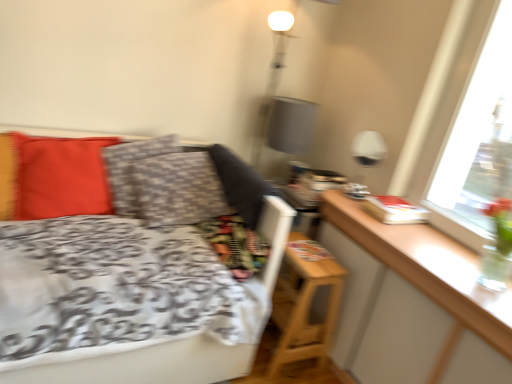
What do you see at coordinates (58, 176) in the screenshot? I see `matte red pillow at left, which is counted as the 2th pillow, starting from the right` at bounding box center [58, 176].

Find the location of a particular element. This screenshot has width=512, height=384. wooden nightstand at lower right is located at coordinates (304, 302).

Find the location of `matte red pillow at left, which is counted as the 2th pillow, starting from the right`. matte red pillow at left, which is counted as the 2th pillow, starting from the right is located at coordinates (58, 176).

Looking at their sizes, would you say wooden table at right is wider or thinner than wooden nightstand at lower right?

In the image, wooden table at right appears to be more narrow than wooden nightstand at lower right.

Between wooden table at right and wooden nightstand at lower right, which one is positioned in front?

wooden table at right is closer to the camera.

Is wooden table at right surrounding wooden nightstand at lower right?

Result: No, wooden nightstand at lower right is not inside wooden table at right.

Between wooden table at right and wooden nightstand at lower right, which one appears on the left side from the viewer's perspective?

wooden nightstand at lower right.

In the scene shown: Can you confirm if matte red pillow at left, the first pillow viewed from the left, is taller than patterned fabric pillow at center, which appears as the 1th pillow when viewed from the right?

Correct, matte red pillow at left, the first pillow viewed from the left, is much taller as patterned fabric pillow at center, which appears as the 1th pillow when viewed from the right.

Which object is wider, matte red pillow at left, the first pillow viewed from the left, or patterned fabric pillow at center, acting as the 2th pillow starting from the left?

patterned fabric pillow at center, acting as the 2th pillow starting from the left, is wider.

Is matte red pillow at left, the first pillow viewed from the left, not inside patterned fabric pillow at center, which appears as the 1th pillow when viewed from the right?

That's correct, matte red pillow at left, the first pillow viewed from the left, is outside of patterned fabric pillow at center, which appears as the 1th pillow when viewed from the right.

The image size is (512, 384). In the image, there is a patterned fabric pillow at center, which appears as the 1th pillow when viewed from the right. In order to click on pillow below it (from a real-world perspective) in this screenshot , I will do `click(58, 176)`.

In terms of width, does wooden nightstand at lower right look wider or thinner when compared to matte red pillow at left, the first pillow viewed from the left?

Considering their sizes, wooden nightstand at lower right looks broader than matte red pillow at left, the first pillow viewed from the left.

Does wooden nightstand at lower right have a larger size compared to matte red pillow at left, the first pillow viewed from the left?

Correct, wooden nightstand at lower right is larger in size than matte red pillow at left, the first pillow viewed from the left.

Considering the relative positions of wooden nightstand at lower right and matte red pillow at left, which is counted as the 2th pillow, starting from the right, in the image provided, is wooden nightstand at lower right to the left of matte red pillow at left, which is counted as the 2th pillow, starting from the right, from the viewer's perspective?

In fact, wooden nightstand at lower right is to the right of matte red pillow at left, which is counted as the 2th pillow, starting from the right.

Where is `nightstand behind the matte red pillow at left, the first pillow viewed from the left`? nightstand behind the matte red pillow at left, the first pillow viewed from the left is located at coordinates (304, 302).

Would you say patterned fabric pillow at center, acting as the 2th pillow starting from the left, contains white glossy table lamp at upper right?

No, patterned fabric pillow at center, acting as the 2th pillow starting from the left, does not contain white glossy table lamp at upper right.

Is there a large distance between patterned fabric pillow at center, which appears as the 1th pillow when viewed from the right, and white glossy table lamp at upper right?

Absolutely, patterned fabric pillow at center, which appears as the 1th pillow when viewed from the right, is distant from white glossy table lamp at upper right.

From the image's perspective, between patterned fabric pillow at center, acting as the 2th pillow starting from the left, and white glossy table lamp at upper right, which one is located above?

From the image's view, white glossy table lamp at upper right is above.

The image size is (512, 384). In order to click on pillow that is the 1st one when counting forward from the white glossy table lamp at upper right in this screenshot , I will do `click(128, 169)`.

In the image, is wooden nightstand at lower right on the left side or the right side of wooden table at right?

wooden nightstand at lower right is positioned on wooden table at right's left side.

Does wooden nightstand at lower right have a larger size compared to wooden table at right?

Correct, wooden nightstand at lower right is larger in size than wooden table at right.

In the scene shown: Is wooden table at right located within wooden nightstand at lower right?

Definitely not — wooden table at right is not inside wooden nightstand at lower right.

Considering the relative sizes of wooden nightstand at lower right and wooden table at right in the image provided, is wooden nightstand at lower right shorter than wooden table at right?

No.

Are wooden table at right and matte red pillow at left, the first pillow viewed from the left, far apart?

Yes, wooden table at right is far from matte red pillow at left, the first pillow viewed from the left.

Between point (343, 198) and point (65, 178), which one is positioned behind?

The point (343, 198) is farther.

Considering the relative sizes of wooden table at right and matte red pillow at left, which is counted as the 2th pillow, starting from the right, in the image provided, is wooden table at right thinner than matte red pillow at left, which is counted as the 2th pillow, starting from the right,?

No, wooden table at right is not thinner than matte red pillow at left, which is counted as the 2th pillow, starting from the right.

How many degrees apart are the facing directions of wooden nightstand at lower right and white glossy table lamp at upper right?

0.000437 degrees separate the facing orientations of wooden nightstand at lower right and white glossy table lamp at upper right.

Identify the location of nightstand in front of the white glossy table lamp at upper right. The image size is (512, 384). (304, 302).

Does wooden nightstand at lower right have a larger size compared to white glossy table lamp at upper right?

Yes.

Image resolution: width=512 pixels, height=384 pixels. Identify the location of table located on the right of wooden nightstand at lower right. (412, 303).

At what (x,y) coordinates should I click in order to perform the action: click on pillow located behind the matte red pillow at left, the first pillow viewed from the left. Please return your answer as a coordinate pair (x, y). This screenshot has width=512, height=384. Looking at the image, I should click on (128, 169).

Looking at the image, which one is located closer to wooden table at right, matte red pillow at left, the first pillow viewed from the left, or patterned fabric pillow at center, which appears as the 1th pillow when viewed from the right?

patterned fabric pillow at center, which appears as the 1th pillow when viewed from the right, is closer to wooden table at right.

Looking at the image, which one is located further to patterned fabric pillow at center, which appears as the 1th pillow when viewed from the right, white glossy table lamp at upper right or wooden nightstand at lower right?

white glossy table lamp at upper right is positioned further to the anchor patterned fabric pillow at center, which appears as the 1th pillow when viewed from the right.

When comparing their distances from wooden table at right, does wooden nightstand at lower right or matte red pillow at left, the first pillow viewed from the left, seem further?

matte red pillow at left, the first pillow viewed from the left, is further to wooden table at right.

Considering their positions, is wooden table at right positioned further to white glossy table lamp at upper right than matte red pillow at left, the first pillow viewed from the left?

matte red pillow at left, the first pillow viewed from the left, is positioned further to the anchor white glossy table lamp at upper right.

From the image, which object appears to be farther from white glossy table lamp at upper right, wooden table at right or patterned fabric pillow at center, which appears as the 1th pillow when viewed from the right?

patterned fabric pillow at center, which appears as the 1th pillow when viewed from the right, lies further to white glossy table lamp at upper right than the other object.

Based on their spatial positions, is white glossy table lamp at upper right or wooden table at right further from wooden nightstand at lower right?

white glossy table lamp at upper right is positioned further to the anchor wooden nightstand at lower right.

Which object lies nearer to the anchor point wooden nightstand at lower right, matte red pillow at left, which is counted as the 2th pillow, starting from the right, or patterned fabric pillow at center, acting as the 2th pillow starting from the left?

patterned fabric pillow at center, acting as the 2th pillow starting from the left, is closer to wooden nightstand at lower right.

When comparing their distances from white glossy table lamp at upper right, does wooden nightstand at lower right or matte red pillow at left, the first pillow viewed from the left, seem further?

matte red pillow at left, the first pillow viewed from the left, is positioned further to the anchor white glossy table lamp at upper right.

Where is `pillow between matte red pillow at left, which is counted as the 2th pillow, starting from the right, and wooden nightstand at lower right`? The width and height of the screenshot is (512, 384). pillow between matte red pillow at left, which is counted as the 2th pillow, starting from the right, and wooden nightstand at lower right is located at coordinates (128, 169).

This screenshot has height=384, width=512. I want to click on table lamp between matte red pillow at left, the first pillow viewed from the left, and wooden table at right, in the horizontal direction, so click(x=365, y=159).

Identify the location of nightstand between patterned fabric pillow at center, acting as the 2th pillow starting from the left, and white glossy table lamp at upper right from left to right. The width and height of the screenshot is (512, 384). (304, 302).

Identify the location of nightstand between matte red pillow at left, which is counted as the 2th pillow, starting from the right, and white glossy table lamp at upper right. (304, 302).